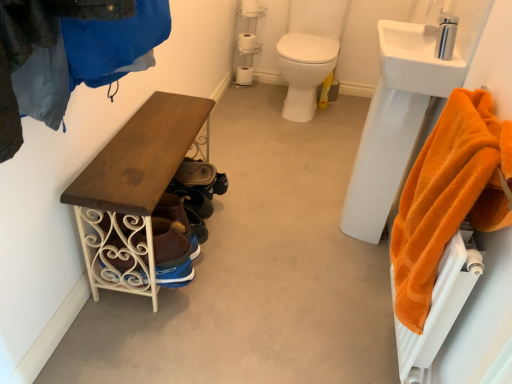
Find the location of `empty space that is to the right of white plastic shelf at center`. empty space that is to the right of white plastic shelf at center is located at coordinates (269, 83).